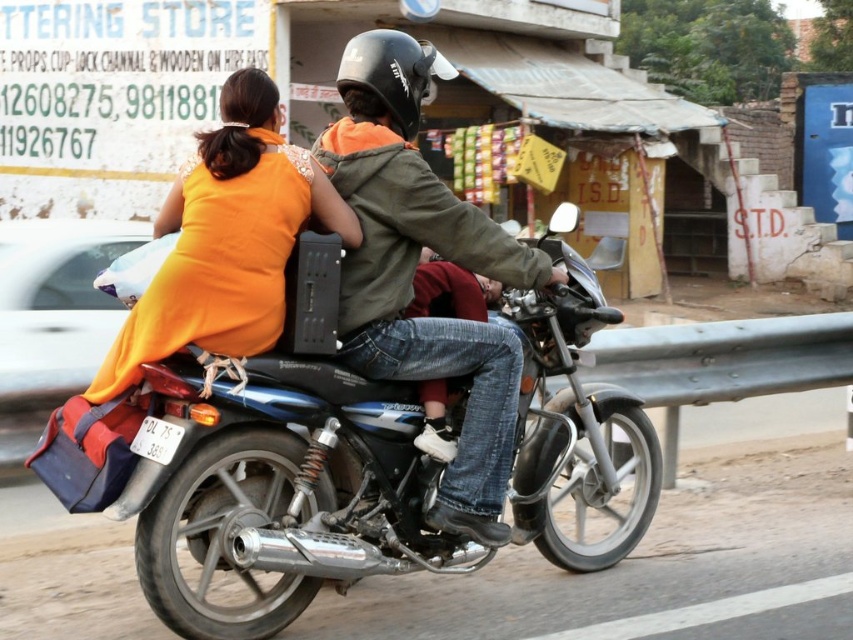
Can you confirm if shiny metallic motorcycle at center is positioned above green matte jacket at center?

No, shiny metallic motorcycle at center is not above green matte jacket at center.

Between shiny metallic motorcycle at center and green matte jacket at center, which one has less height?

shiny metallic motorcycle at center is shorter.

Locate an element on the screen. This screenshot has height=640, width=853. shiny metallic motorcycle at center is located at coordinates (276, 486).

What are the coordinates of `shiny metallic motorcycle at center` in the screenshot? It's located at (276, 486).

Can you confirm if green matte jacket at center is taller than orange fabric dress at upper left?

Yes, green matte jacket at center is taller than orange fabric dress at upper left.

Can you confirm if green matte jacket at center is positioned below orange fabric dress at upper left?

Yes.

The height and width of the screenshot is (640, 853). Find the location of `green matte jacket at center`. green matte jacket at center is located at coordinates (416, 266).

Where is `green matte jacket at center`? green matte jacket at center is located at coordinates (416, 266).

Who is more distant from viewer, (x=119, y=506) or (x=248, y=96)?

Point (x=248, y=96)

In order to click on shiny metallic motorcycle at center in this screenshot , I will do `click(276, 486)`.